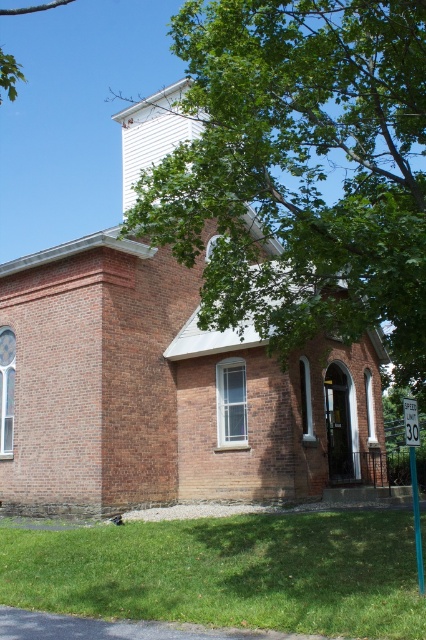
You are standing at the point with coordinates [164,392] in the image. Based on the scene description, what object are you most likely standing on?

The point at coordinates [164,392] corresponds to the brick building at center, so you are most likely standing on the brick building at center.

You are standing in front of the brick building at center and want to take a photo of the green leafy tree at upper center. Since the building is in the way, can you move to the side to get a clear shot without the building blocking the tree?

The brick building at center is further to the viewer than the green leafy tree at upper center. Therefore, moving to the side might allow you to position yourself so that the tree is no longer directly behind the building, providing an unobstructed view for your photo.

You are a painter standing at the entrance of the brick building at center. You want to paint the green leafy tree at upper center. Which object should you look up to paint?

The green leafy tree at upper center is located at upper center, so you should look up to paint the green leafy tree at upper center.